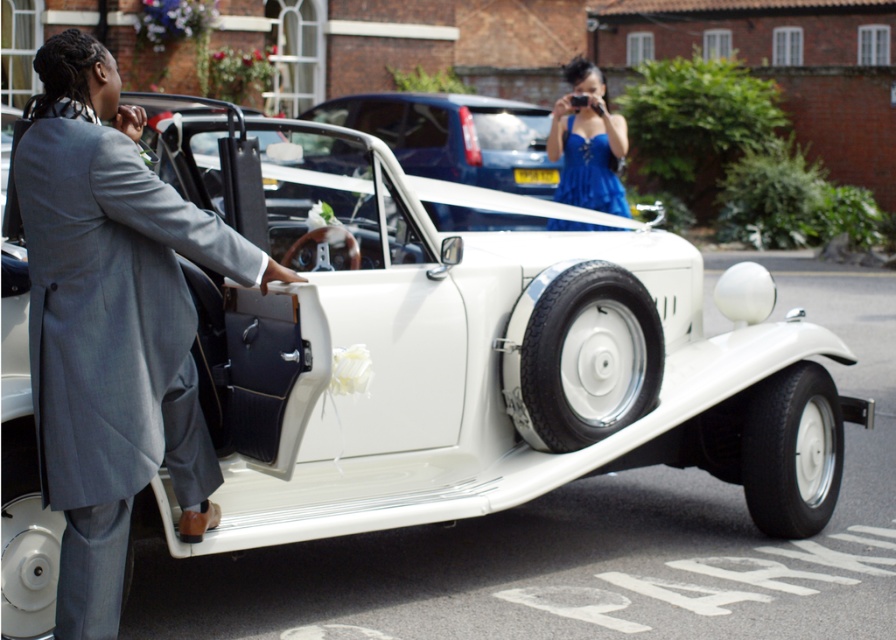
You are a photographer at a wedding event. You need to position the gray wool suit at left and the blue satin dress at upper center in your shot. Which one should you focus on if you want to capture the wider object?

The blue satin dress at upper center should be focused on since it has a greater width than the gray wool suit at left.

You are a photographer at a wedding event. You need to capture a photo of the gray wool suit at left and the blue satin dress at upper center. Which one is positioned closer to the camera?

The gray wool suit at left is closer to the viewer than the blue satin dress at upper center, so the gray wool suit at left will appear larger in the photo.

You are standing at the camera position and want to pick up the gray wool suit at left. Can you reach it without moving from where you are?

The gray wool suit at left is 16.35 feet away from the camera position. Since this distance is too far to reach without moving, you cannot pick up the gray wool suit at left from your current position.